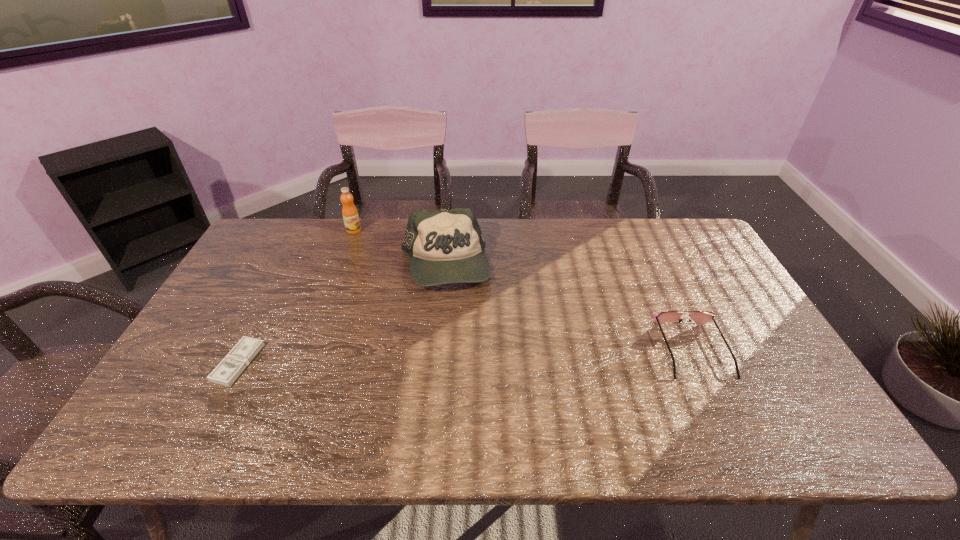
Identify the location of vacant space in between the third object from left to right and the sunglasses. (568, 307).

Image resolution: width=960 pixels, height=540 pixels. I want to click on the second closest object relative to the leftmost object, so click(x=350, y=215).

Locate an element on the screen. object that stands as the closest to the third tallest object is located at coordinates (445, 247).

I want to click on free space that satisfies the following two spatial constraints: 1. on the back side of the farthest object; 2. on the right side of the leftmost object, so click(x=306, y=230).

Locate an element on the screen. vacant area that satisfies the following two spatial constraints: 1. on the back side of the baseball cap; 2. on the left side of the money is located at coordinates (289, 265).